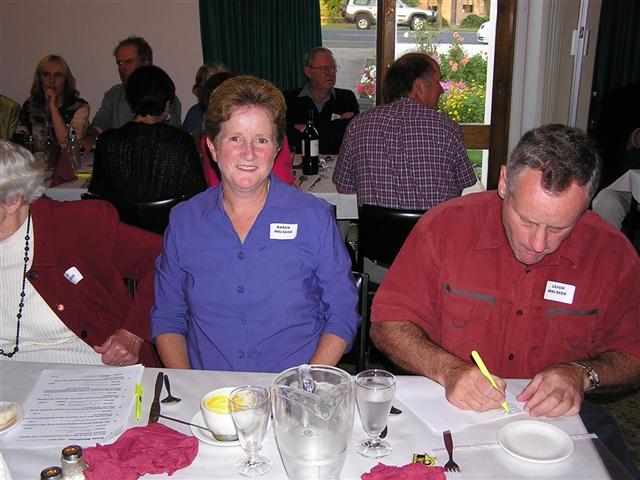
At what (x,y) coordinates should I click in order to perform the action: click on fork. Please return your answer as a coordinate pair (x, y). Looking at the image, I should click on (450, 452).